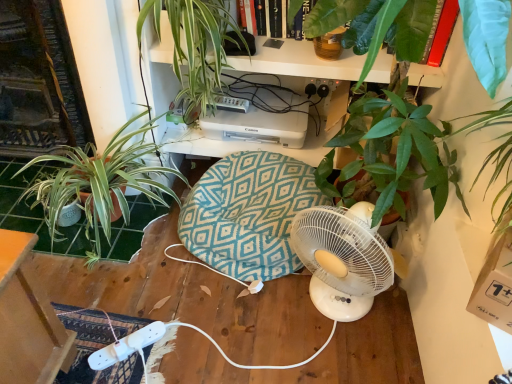
Question: Is teal fabric swivel chair at center placed right next to black plastic plug at upper center?

Choices:
 (A) no
 (B) yes

Answer: (A)

Question: Considering the relative sizes of teal fabric swivel chair at center and black plastic plug at upper center in the image provided, is teal fabric swivel chair at center thinner than black plastic plug at upper center?

Choices:
 (A) no
 (B) yes

Answer: (A)

Question: Is teal fabric swivel chair at center shorter than black plastic plug at upper center?

Choices:
 (A) no
 (B) yes

Answer: (A)

Question: From the image's perspective, is teal fabric swivel chair at center on top of black plastic plug at upper center?

Choices:
 (A) yes
 (B) no

Answer: (B)

Question: Is teal fabric swivel chair at center to the right of black plastic plug at upper center from the viewer's perspective?

Choices:
 (A) yes
 (B) no

Answer: (B)

Question: Is teal fabric swivel chair at center far away from black plastic plug at upper center?

Choices:
 (A) no
 (B) yes

Answer: (A)

Question: From a real-world perspective, is teal fabric swivel chair at center physically below green leafy plant at upper center, the 2th houseplant from the left?

Choices:
 (A) yes
 (B) no

Answer: (A)

Question: Considering the relative sizes of teal fabric swivel chair at center and green leafy plant at upper center, the 2th houseplant from the left, in the image provided, is teal fabric swivel chair at center bigger than green leafy plant at upper center, the 2th houseplant from the left,?

Choices:
 (A) no
 (B) yes

Answer: (B)

Question: Is teal fabric swivel chair at center positioned before green leafy plant at upper center, the 2th houseplant from the left?

Choices:
 (A) yes
 (B) no

Answer: (B)

Question: Is the position of teal fabric swivel chair at center more distant than that of green leafy plant at upper center, the 2th houseplant from the left?

Choices:
 (A) no
 (B) yes

Answer: (B)

Question: Is teal fabric swivel chair at center thinner than green leafy plant at upper center, the 2th houseplant from the left?

Choices:
 (A) no
 (B) yes

Answer: (B)

Question: Are teal fabric swivel chair at center and green leafy plant at upper center, the 1th houseplant from the right, located far from each other?

Choices:
 (A) no
 (B) yes

Answer: (A)

Question: Is black plastic plug at upper center facing towards teal fabric swivel chair at center?

Choices:
 (A) no
 (B) yes

Answer: (A)